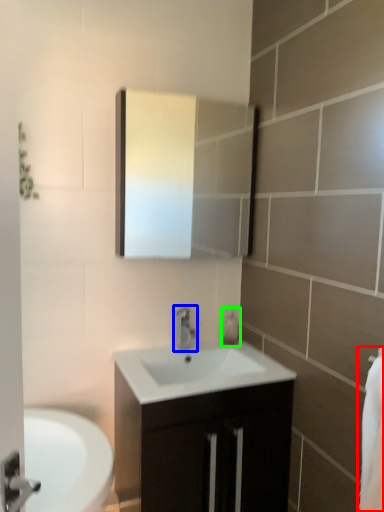
Question: Which object is positioned farthest from bath towel (highlighted by a red box)? Select from tap (highlighted by a blue box) and soap dispenser (highlighted by a green box).

Choices:
 (A) tap
 (B) soap dispenser

Answer: (B)